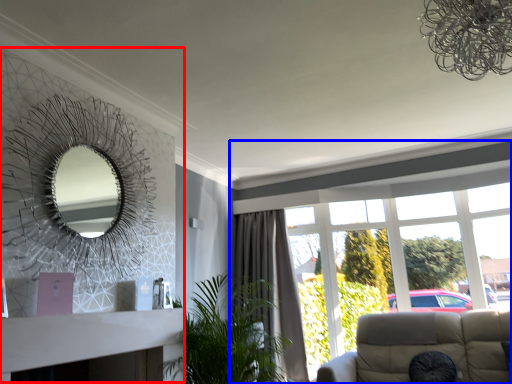
Question: Which point is closer to the camera, fireplace (highlighted by a red box) or window (highlighted by a blue box)?

Choices:
 (A) fireplace
 (B) window

Answer: (A)